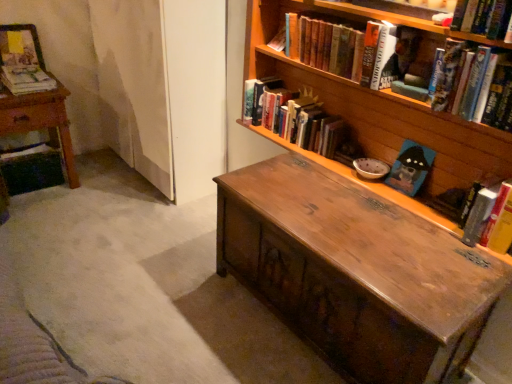
Question: Considering the relative positions of hardcover book at upper center, the fourth book when ordered from right to left, and hardcover book at upper right, arranged as the sixth book when viewed from the left, in the image provided, is hardcover book at upper center, the fourth book when ordered from right to left, behind hardcover book at upper right, arranged as the sixth book when viewed from the left,?

Choices:
 (A) no
 (B) yes

Answer: (B)

Question: Can you confirm if hardcover book at upper center, the fourth book when ordered from right to left, is positioned to the right of hardcover book at upper right, arranged as the sixth book when viewed from the left?

Choices:
 (A) yes
 (B) no

Answer: (B)

Question: Is hardcover book at upper center, the fourth book when ordered from right to left, taller than hardcover book at upper right, arranged as the sixth book when viewed from the left?

Choices:
 (A) yes
 (B) no

Answer: (B)

Question: From the image's perspective, does hardcover book at upper center, marked as the fourth book in a left-to-right arrangement, appear lower than hardcover book at upper right, which is the second book in right-to-left order?

Choices:
 (A) no
 (B) yes

Answer: (A)

Question: Is hardcover book at upper center, the fourth book when ordered from right to left, far away from hardcover book at upper right, arranged as the sixth book when viewed from the left?

Choices:
 (A) yes
 (B) no

Answer: (B)

Question: Can hardcover book at upper right, arranged as the sixth book when viewed from the left, be found inside hardcover book at upper center, the fourth book when ordered from right to left?

Choices:
 (A) no
 (B) yes

Answer: (A)

Question: From a real-world perspective, is hardcover book at center, placed as the fifth book when sorted from right to left, on top of blue matte book at center right, placed as the fifth book when sorted from left to right?

Choices:
 (A) no
 (B) yes

Answer: (B)

Question: Is hardcover book at center, which is the third book in left-to-right order, turned away from blue matte book at center right, placed as the fifth book when sorted from left to right?

Choices:
 (A) no
 (B) yes

Answer: (A)

Question: Are hardcover book at center, which is the third book in left-to-right order, and blue matte book at center right, placed as the fifth book when sorted from left to right, located far from each other?

Choices:
 (A) yes
 (B) no

Answer: (B)

Question: Is hardcover book at center, placed as the fifth book when sorted from right to left, to the right of blue matte book at center right, which is the third book from right to left, from the viewer's perspective?

Choices:
 (A) no
 (B) yes

Answer: (A)

Question: Can you confirm if hardcover book at center, placed as the fifth book when sorted from right to left, is taller than blue matte book at center right, which is the third book from right to left?

Choices:
 (A) no
 (B) yes

Answer: (B)

Question: Is hardcover book at center, which is the third book in left-to-right order, in contact with blue matte book at center right, which is the third book from right to left?

Choices:
 (A) no
 (B) yes

Answer: (A)

Question: Considering the relative sizes of hardcover book at upper right, which is the second book in right-to-left order, and matte paper magazine at upper left, which is counted as the seventh book, starting from the right, in the image provided, is hardcover book at upper right, which is the second book in right-to-left order, bigger than matte paper magazine at upper left, which is counted as the seventh book, starting from the right,?

Choices:
 (A) yes
 (B) no

Answer: (A)